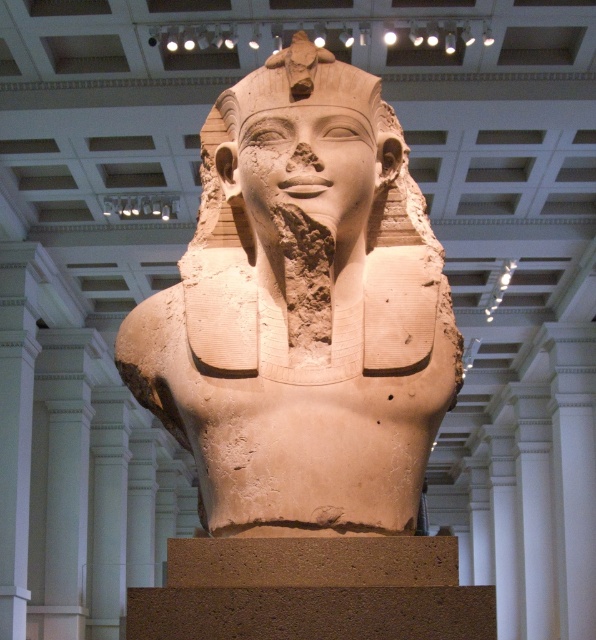
You are an art conservator examining the statue from a distance of 2 meters. You notice two points on the statue labeled as point (274, 164) and point (315, 64). Which point is nearer to your current position?

Point (274, 164) is closer to the camera than point (315, 64), so the point (274, 164) is nearer to your current position.

You are an art conservator tasked with moving the beige stone bust at center and the beige stone head at center from the museum to a storage facility. The storage has a narrow corridor that allows items up to 1.5 meters in width. Which of the two items might not fit through the corridor based on their widths?

The beige stone bust at center has a larger width than the beige stone head at center. Since the corridor allows items up to 1.5 meters in width, the beige stone bust at center might not fit if its width exceeds 1.5 meters, while the beige stone head at center is narrower and would likely fit.